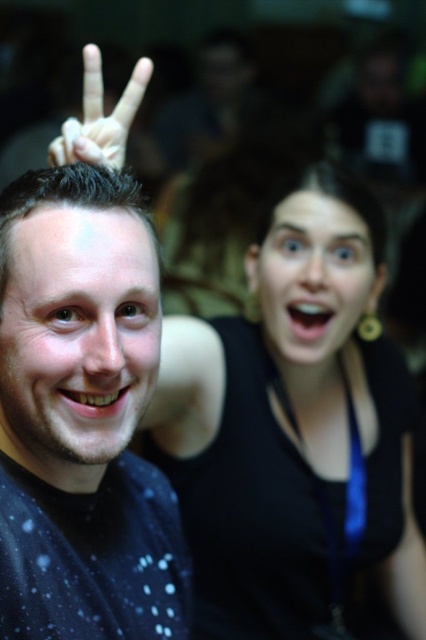
Does black matte tank top at center have a lesser width compared to white matte hand at upper left?

In fact, black matte tank top at center might be wider than white matte hand at upper left.

Which is behind, point (293, 496) or point (123, 109)?

Point (293, 496)

Locate an element on the screen. This screenshot has width=426, height=640. black matte tank top at center is located at coordinates (293, 426).

This screenshot has width=426, height=640. What do you see at coordinates (313, 276) in the screenshot?
I see `matte black face at center` at bounding box center [313, 276].

Is matte black face at center thinner than white matte hand at upper left?

Incorrect, matte black face at center's width is not less than white matte hand at upper left's.

Who is more forward, (307, 348) or (83, 52)?

Point (307, 348) is in front.

Find the location of a particular element. matte black face at center is located at coordinates (313, 276).

Between black matte tank top at center and matte black shirt at center, which one is positioned lower?

black matte tank top at center is below.

Who is higher up, black matte tank top at center or matte black shirt at center?

matte black shirt at center is higher up.

Does point (316, 426) come in front of point (5, 579)?

No, it is not.

Identify the location of black matte tank top at center. Image resolution: width=426 pixels, height=640 pixels. (293, 426).